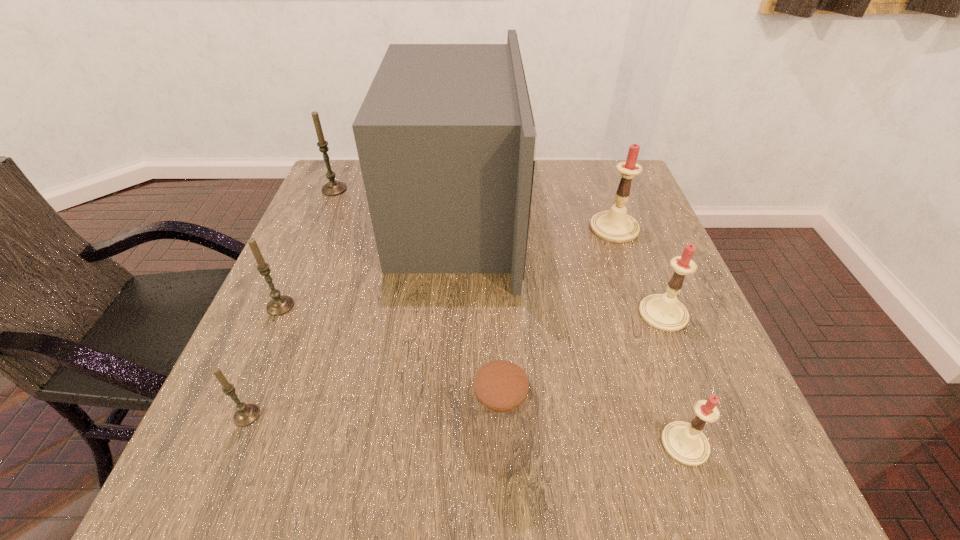
The height and width of the screenshot is (540, 960). What are the coordinates of `free space that satisfies the following two spatial constraints: 1. on the front side of the nearest red candle; 2. on the right side of the biggest gray candle` in the screenshot? It's located at (225, 444).

Where is `free spot that satisfies the following two spatial constraints: 1. on the front side of the second biggest gray candle; 2. on the left side of the jar`? This screenshot has width=960, height=540. free spot that satisfies the following two spatial constraints: 1. on the front side of the second biggest gray candle; 2. on the left side of the jar is located at coordinates [220, 444].